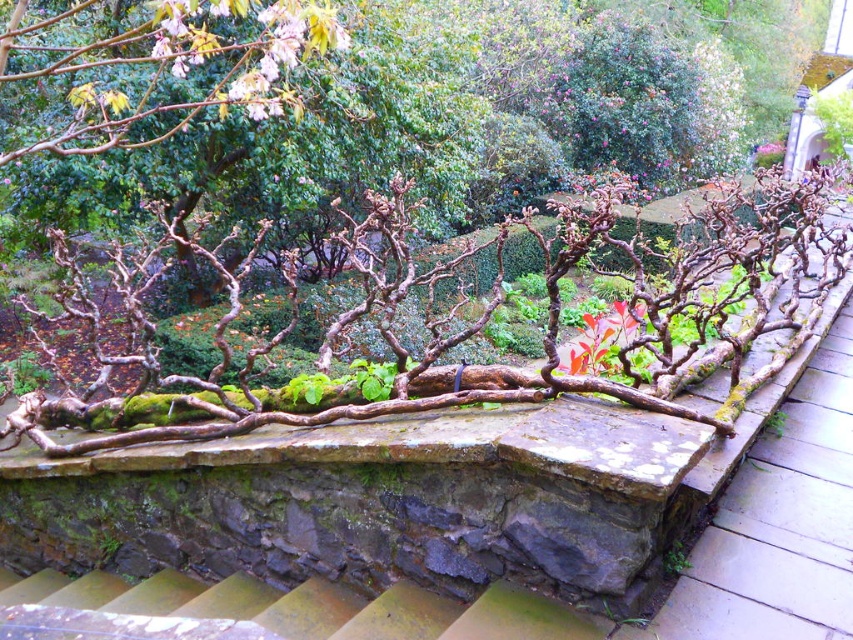
You are standing in the garden scene and want to know how far the point at coordinates (0, 582) is from your current position. Can you determine the distance?

The point at coordinates (0, 582) is 3.72 meters away from the camera, so the distance from your current position would be approximately 3.72 meters.

You are a gardener who wants to walk from the stone wall bench to the garden entrance. You have two paths available. Which path is narrower between the brown stone path at center and the rusty metal stairs at lower left?

The brown stone path at center is thinner than the rusty metal stairs at lower left, so the brown stone path at center is narrower.